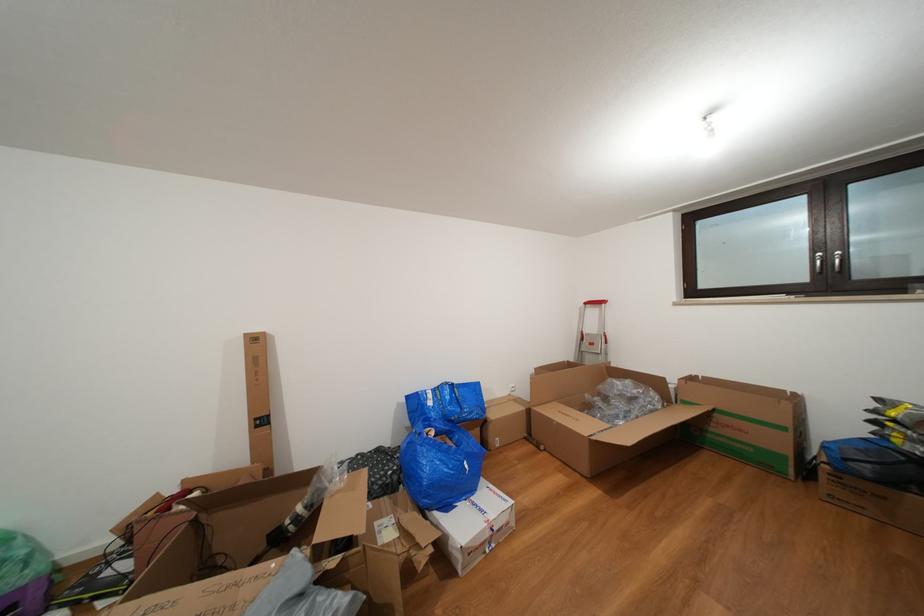
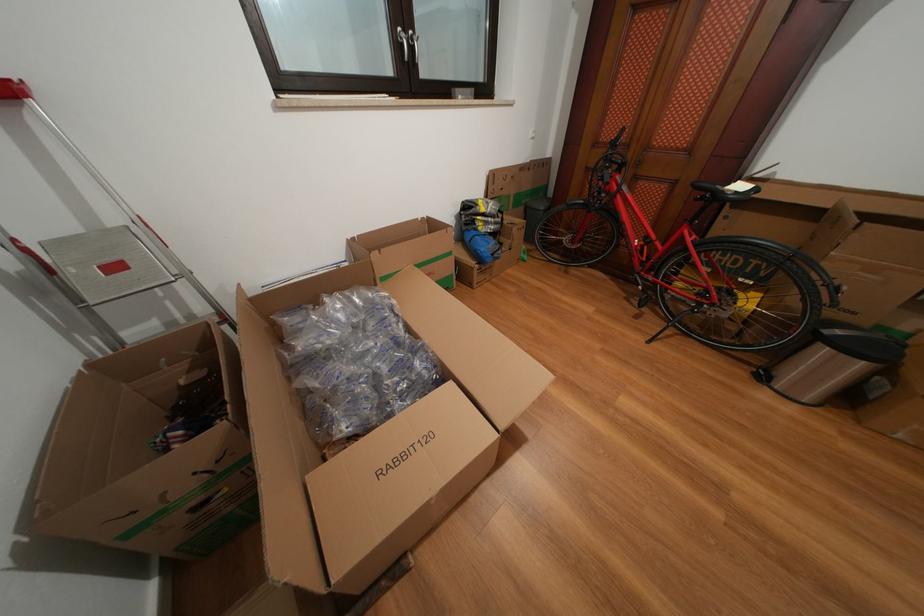
The point at (x=600, y=349) is marked in the first image. Where is the corresponding point in the second image?

(124, 273)